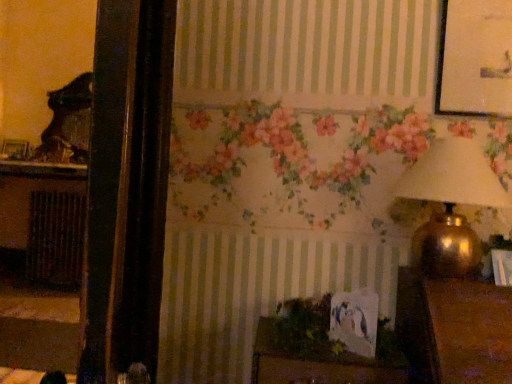
You are a GUI agent. You are given a task and a screenshot of the screen. Output one action in this format:
    pyautogui.click(x=<x>, y=<y>)
    Task: Click on the gold metallic lampshade at upper right
    This screenshot has width=512, height=384.
    Given the screenshot: What is the action you would take?
    pyautogui.click(x=450, y=205)

This screenshot has width=512, height=384. What do you see at coordinates (56, 238) in the screenshot?
I see `brown textured radiator at left` at bounding box center [56, 238].

At what (x,y) coordinates should I click in order to perform the action: click on wooden picture frame at left. Please return your answer as a coordinate pair (x, y). The image size is (512, 384). Looking at the image, I should click on (15, 149).

This screenshot has height=384, width=512. Describe the element at coordinates (304, 325) in the screenshot. I see `green leafy plant at center` at that location.

Find the location of a particular element. The width and height of the screenshot is (512, 384). gold metallic lampshade at upper right is located at coordinates (450, 205).

You are a GUI agent. You are given a task and a screenshot of the screen. Output one action in this format:
    pyautogui.click(x=<x>, y=<y>)
    Task: Click on the radiator on the left of gold metallic lampshade at upper right
    The image size is (512, 384).
    Given the screenshot: What is the action you would take?
    pyautogui.click(x=56, y=238)

Is brown textured radiator at left further to camera compared to gold metallic lampshade at upper right?

That is True.

Considering the sizes of objects brown textured radiator at left and gold metallic lampshade at upper right in the image provided, who is bigger, brown textured radiator at left or gold metallic lampshade at upper right?

With larger size is brown textured radiator at left.

Which object is closer to the camera taking this photo, wooden picture frame at left or brown textured radiator at left?

brown textured radiator at left is more forward.

Is point (9, 149) closer or farther from the camera than point (53, 261)?

Point (9, 149) appears to be farther away from the viewer than point (53, 261).

Would you say wooden picture frame at left is outside brown textured radiator at left?

Yes.

From the image's perspective, who appears lower, wooden picture frame at left or brown textured radiator at left?

brown textured radiator at left.

From a real-world perspective, which object rests below the other?

gold metallic lampshade at upper right, from a real-world perspective.

Is gold metallic lampshade at upper right further to camera compared to wooden picture frame at left?

No, gold metallic lampshade at upper right is in front of wooden picture frame at left.

Find the location of a particular element. This screenshot has height=384, width=512. table lamp to the right of wooden picture frame at left is located at coordinates (450, 205).

Is gold metallic lampshade at upper right taller or shorter than wooden picture frame at left?

Considering their sizes, gold metallic lampshade at upper right has more height than wooden picture frame at left.

From a real-world perspective, which is physically below, gold metallic lampshade at upper right or brown textured radiator at left?

In real-world perspective, brown textured radiator at left is lower.

Measure the distance between gold metallic lampshade at upper right and brown textured radiator at left.

The distance of gold metallic lampshade at upper right from brown textured radiator at left is 3.62 meters.

Considering the relative sizes of gold metallic lampshade at upper right and brown textured radiator at left in the image provided, is gold metallic lampshade at upper right thinner than brown textured radiator at left?

Incorrect, the width of gold metallic lampshade at upper right is not less than that of brown textured radiator at left.

Where is `table lamp lying on the right of brown textured radiator at left`? Image resolution: width=512 pixels, height=384 pixels. table lamp lying on the right of brown textured radiator at left is located at coordinates (450, 205).

Is wooden picture frame at left inside brown textured radiator at left?

No, wooden picture frame at left is located outside of brown textured radiator at left.

From their relative heights in the image, would you say brown textured radiator at left is taller or shorter than wooden picture frame at left?

brown textured radiator at left is taller than wooden picture frame at left.

Considering the sizes of brown textured radiator at left and wooden picture frame at left in the image, is brown textured radiator at left bigger or smaller than wooden picture frame at left?

In the image, brown textured radiator at left appears to be larger than wooden picture frame at left.

Is brown textured radiator at left next to green leafy plant at center?

brown textured radiator at left and green leafy plant at center are not in contact.

Which object is thinner, brown textured radiator at left or green leafy plant at center?

With smaller width is green leafy plant at center.

From the image's perspective, which one is positioned lower, brown textured radiator at left or green leafy plant at center?

brown textured radiator at left, from the image's perspective.

In terms of height, does wooden picture frame at left look taller or shorter compared to green leafy plant at center?

Considering their sizes, wooden picture frame at left has more height than green leafy plant at center.

What's the angular difference between wooden picture frame at left and green leafy plant at center's facing directions?

The angle between the facing direction of wooden picture frame at left and the facing direction of green leafy plant at center is 3.07 degrees.

Would you say wooden picture frame at left is outside green leafy plant at center?

Yes, wooden picture frame at left is located beyond the bounds of green leafy plant at center.

I want to click on table lamp located above the brown textured radiator at left (from the image's perspective), so click(x=450, y=205).

This screenshot has width=512, height=384. What are the coordinates of `radiator located on the right of wooden picture frame at left` in the screenshot? It's located at (56, 238).

Which object lies further to the anchor point brown textured radiator at left, gold metallic lampshade at upper right or green leafy plant at center?

gold metallic lampshade at upper right lies further to brown textured radiator at left than the other object.

Estimate the real-world distances between objects in this image. Which object is closer to gold metallic lampshade at upper right, wooden picture frame at left or green leafy plant at center?

Based on the image, green leafy plant at center appears to be nearer to gold metallic lampshade at upper right.

Estimate the real-world distances between objects in this image. Which object is closer to brown textured radiator at left, green leafy plant at center or gold metallic lampshade at upper right?

Among the two, green leafy plant at center is located nearer to brown textured radiator at left.

Based on their spatial positions, is green leafy plant at center or wooden picture frame at left further from brown textured radiator at left?

green leafy plant at center lies further to brown textured radiator at left than the other object.

Considering their positions, is gold metallic lampshade at upper right positioned closer to wooden picture frame at left than green leafy plant at center?

The object closer to wooden picture frame at left is green leafy plant at center.

In the scene shown: Looking at the image, which one is located closer to gold metallic lampshade at upper right, brown textured radiator at left or wooden picture frame at left?

Based on the image, brown textured radiator at left appears to be nearer to gold metallic lampshade at upper right.

From the image, which object appears to be nearer to wooden picture frame at left, green leafy plant at center or brown textured radiator at left?

brown textured radiator at left is closer to wooden picture frame at left.

When comparing their distances from brown textured radiator at left, does wooden picture frame at left or gold metallic lampshade at upper right seem further?

Among the two, gold metallic lampshade at upper right is located further to brown textured radiator at left.

Find the location of a particular element. plant between gold metallic lampshade at upper right and wooden picture frame at left from front to back is located at coordinates (304, 325).

The width and height of the screenshot is (512, 384). I want to click on plant between gold metallic lampshade at upper right and brown textured radiator at left along the z-axis, so click(x=304, y=325).

Image resolution: width=512 pixels, height=384 pixels. What are the coordinates of `radiator positioned between gold metallic lampshade at upper right and wooden picture frame at left from near to far` in the screenshot? It's located at [x=56, y=238].

Find the location of a particular element. Image resolution: width=512 pixels, height=384 pixels. radiator between green leafy plant at center and wooden picture frame at left along the z-axis is located at coordinates (56, 238).